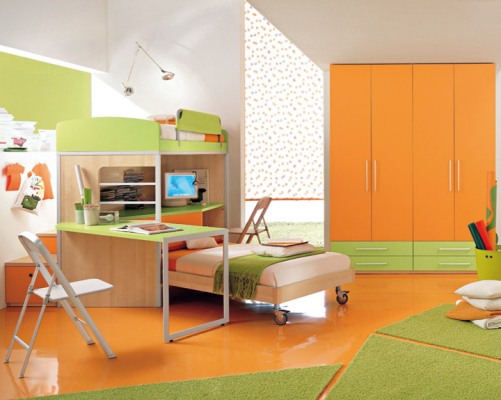
This screenshot has width=501, height=400. I want to click on locker handle, so click(x=460, y=179), click(x=451, y=178), click(x=375, y=183), click(x=367, y=183).